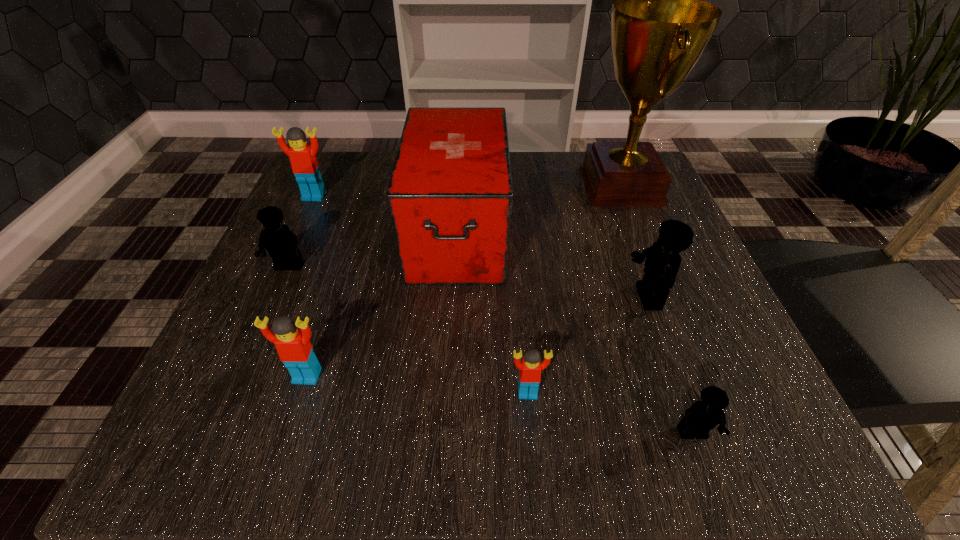
Identify the location of vacant point located between the farthest yellow Lego and the nearest Lego. (491, 350).

Locate an element on the screen. This screenshot has height=540, width=960. free spot between the second nearest yellow Lego and the nearest object is located at coordinates (670, 366).

I want to click on vacant space that is in between the third nearest object and the farthest Lego, so click(311, 286).

The width and height of the screenshot is (960, 540). Identify the location of vacant point located between the first-aid kit and the farthest yellow Lego. (373, 249).

At what (x,y) coordinates should I click in order to perform the action: click on free space between the second nearest yellow Lego and the tallest object. Please return your answer as a coordinate pair (x, y). The image size is (960, 540). Looking at the image, I should click on (634, 241).

Identify the location of unoccupied area between the gold award and the biggest yellow Lego. (634, 241).

You are a GUI agent. You are given a task and a screenshot of the screen. Output one action in this format:
    pyautogui.click(x=<x>, y=<y>)
    Task: Click on the fifth closest object to the seventh shortest object
    This screenshot has width=960, height=540.
    Given the screenshot: What is the action you would take?
    pyautogui.click(x=530, y=367)

Identify the location of object that ranks as the fifth closest to the second biggest yellow Lego. (660, 27).

You are a GUI agent. You are given a task and a screenshot of the screen. Output one action in this format:
    pyautogui.click(x=<x>, y=<y>)
    Task: Click on the Lego that is the fourth closest to the rightmost red Lego
    This screenshot has height=540, width=960.
    Given the screenshot: What is the action you would take?
    pyautogui.click(x=281, y=243)

Where is `Lego that is the third closest to the tallest object`? This screenshot has height=540, width=960. Lego that is the third closest to the tallest object is located at coordinates (702, 416).